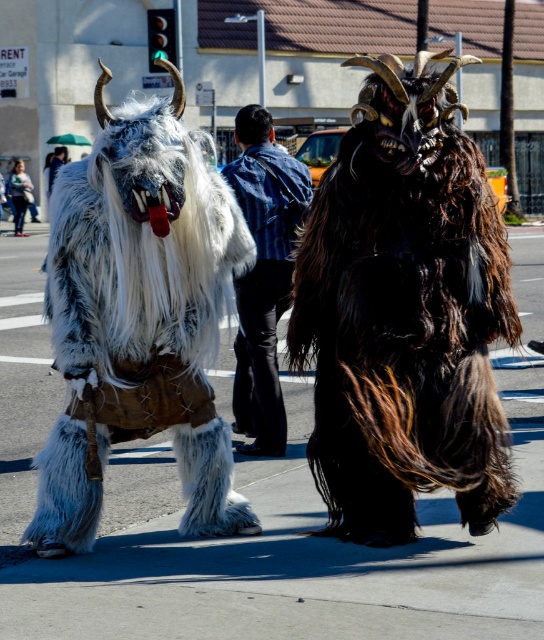
Question: Is shaggy fur costume at center above denim jacket at upper center?

Choices:
 (A) yes
 (B) no

Answer: (B)

Question: Does shaggy fur costume at center appear on the right side of denim jacket at upper center?

Choices:
 (A) yes
 (B) no

Answer: (A)

Question: Can you confirm if denim jacket at center is wider than denim jacket at upper center?

Choices:
 (A) no
 (B) yes

Answer: (A)

Question: Considering the real-world distances, which object is closest to the denim jacket at upper center?

Choices:
 (A) denim jacket at center
 (B) shaggy fur costume at center

Answer: (A)

Question: Considering the real-world distances, which object is farthest from the white furry bull at center?

Choices:
 (A) denim jacket at center
 (B) shaggy fur costume at center
 (C) denim jacket at upper center

Answer: (C)

Question: Which of the following is the farthest from the observer?

Choices:
 (A) denim jacket at center
 (B) white furry bull at center
 (C) shaggy fur costume at center

Answer: (A)